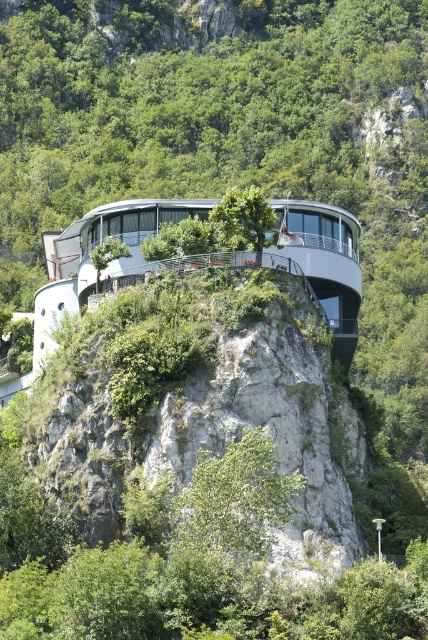
Question: Which object is closer to the camera taking this photo?

Choices:
 (A) white stone cliff at center
 (B) green leafy tree at center

Answer: (A)

Question: Can you confirm if white stone cliff at center is wider than green leafy tree at center?

Choices:
 (A) yes
 (B) no

Answer: (A)

Question: Considering the relative positions of white stone cliff at center and green leafy tree at center in the image provided, where is white stone cliff at center located with respect to green leafy tree at center?

Choices:
 (A) above
 (B) below

Answer: (B)

Question: Which object appears farthest from the camera in this image?

Choices:
 (A) white stone cliff at center
 (B) green leafy tree at center

Answer: (B)

Question: Does white stone cliff at center come in front of green leafy tree at center?

Choices:
 (A) yes
 (B) no

Answer: (A)